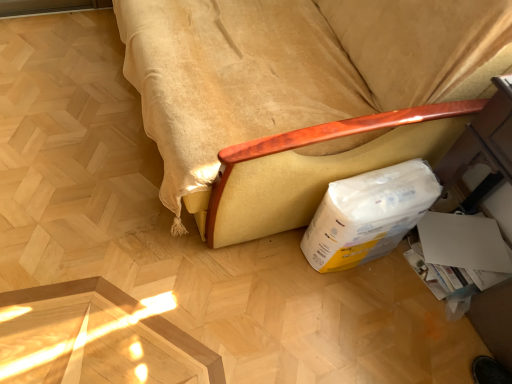
Where is `wooden armchair at lower right`? This screenshot has height=384, width=512. wooden armchair at lower right is located at coordinates (298, 95).

What do you see at coordinates (298, 95) in the screenshot?
I see `wooden armchair at lower right` at bounding box center [298, 95].

The image size is (512, 384). Find the location of `wooden armchair at lower right`. wooden armchair at lower right is located at coordinates (298, 95).